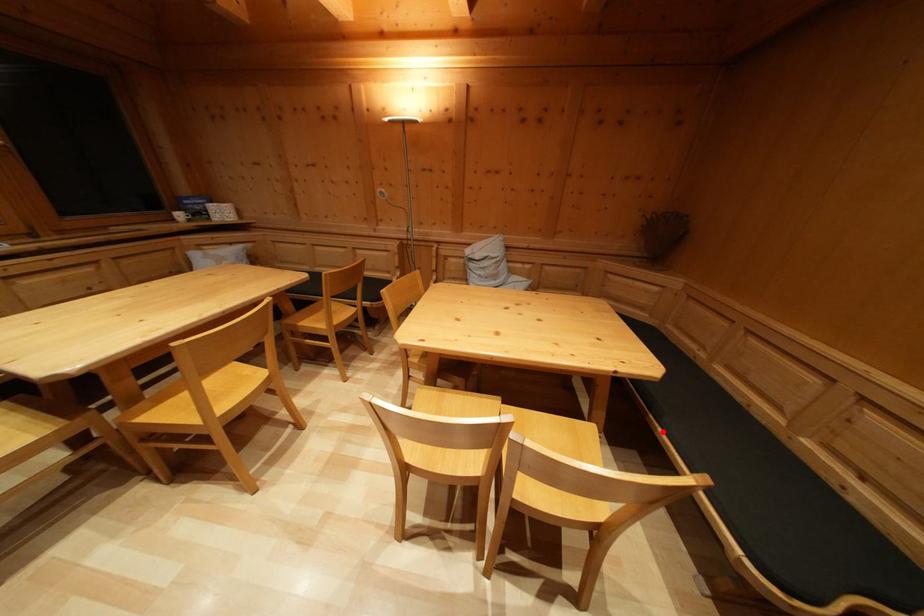
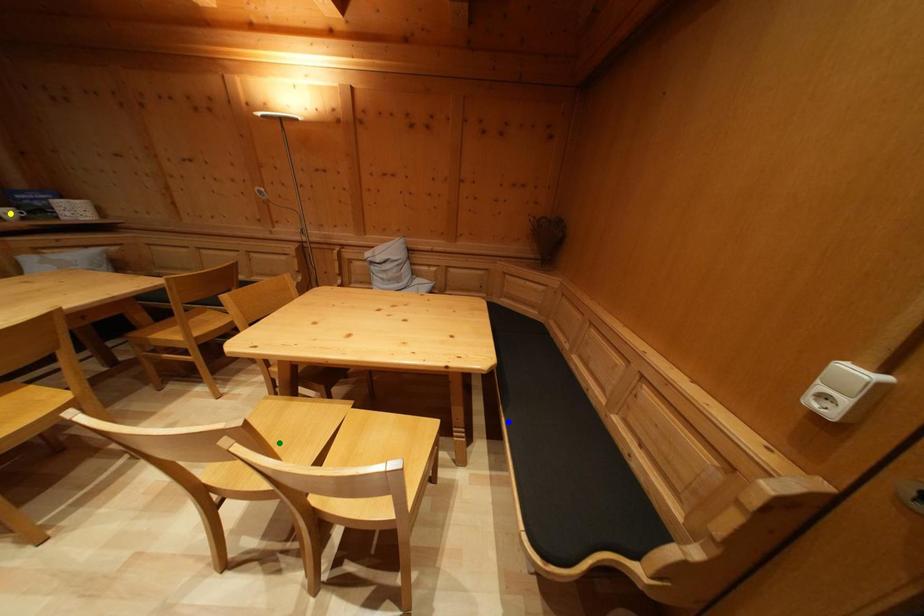
Question: I am providing you with two images of the same scene from different viewpoints. A red point is marked on the first image. You are given multiple points on the second image. Can you choose the point in image 2 that corresponds to the point in image 1?

Choices:
 (A) blue point
 (B) yellow point
 (C) green point

Answer: (A)